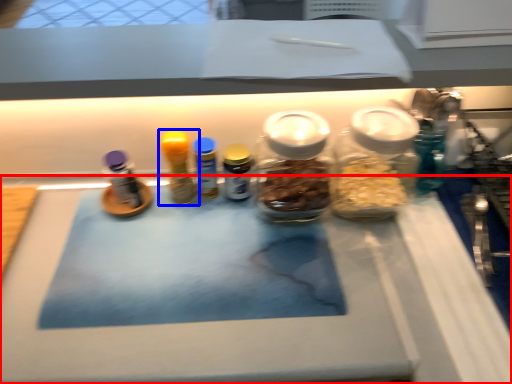
Question: Which point is closer to the camera, table (highlighted by a red box) or bottle (highlighted by a blue box)?

Choices:
 (A) table
 (B) bottle

Answer: (A)